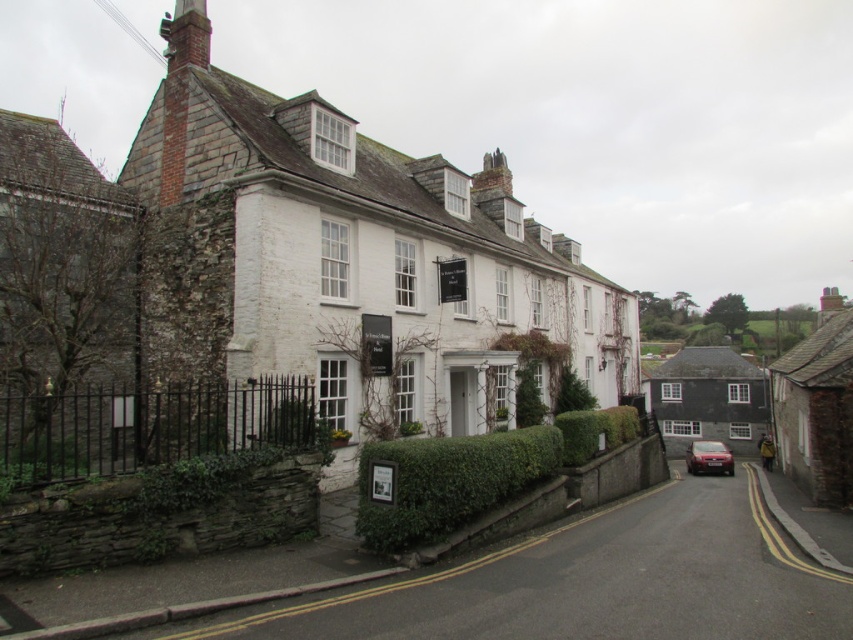
You are a delivery person trying to navigate through the street scene. You see a green leafy hedge at lower center and a metallic red car at lower right. Which object is positioned higher from the ground?

The green leafy hedge at lower center is above metallic red car at lower right, so the hedge is higher from the ground than the car.

You are a delivery driver who needs to park your metallic red car at lower right. There is a green leafy hedge at center blocking the parking spot. Can you move the hedge to make space?

The green leafy hedge at center is positioned over the metallic red car at lower right, so you cannot move the hedge to make space because it is already above the car.